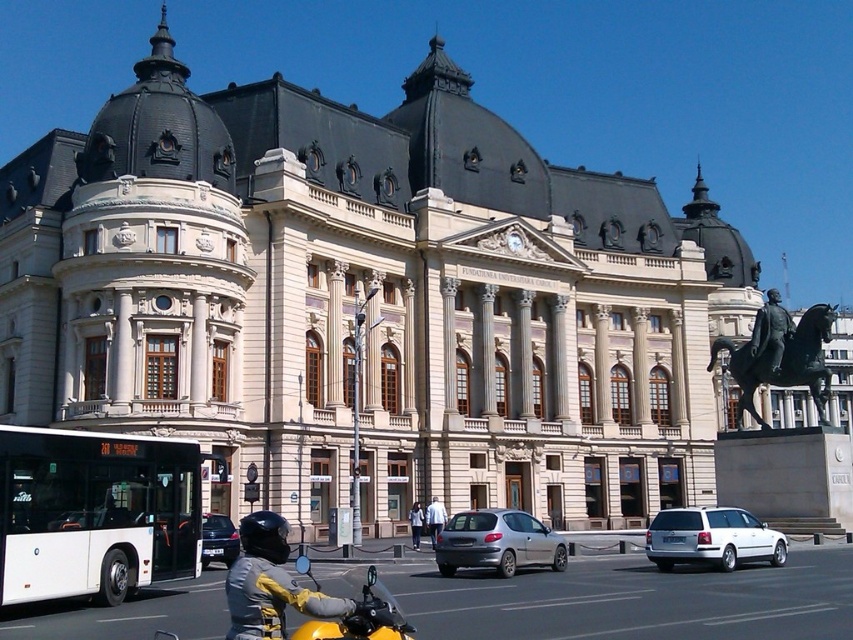
You are standing in front of the grand neoclassical building and see the point marked at coordinates (94, 513). What object is located at that point?

The point at (94, 513) indicates a white matte bus at lower left.

You are a photographer planning to capture the grand building in the image. You need to ensure that both the white matte bus at lower left and the yellow matte jacket at lower center are visible in your shot. Given their sizes, which object might you need to position closer to the camera to include both in the frame without cropping?

The white matte bus at lower left occupies less space than the yellow matte jacket at lower center. To include both in the frame without cropping, you should position the white matte bus at lower left closer to the camera since it is smaller and requires less space to capture fully.